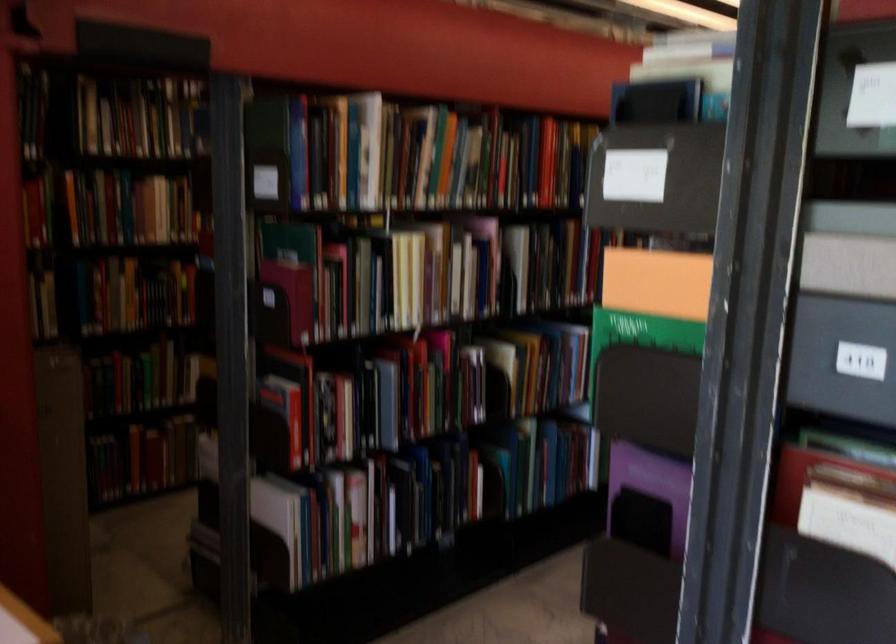
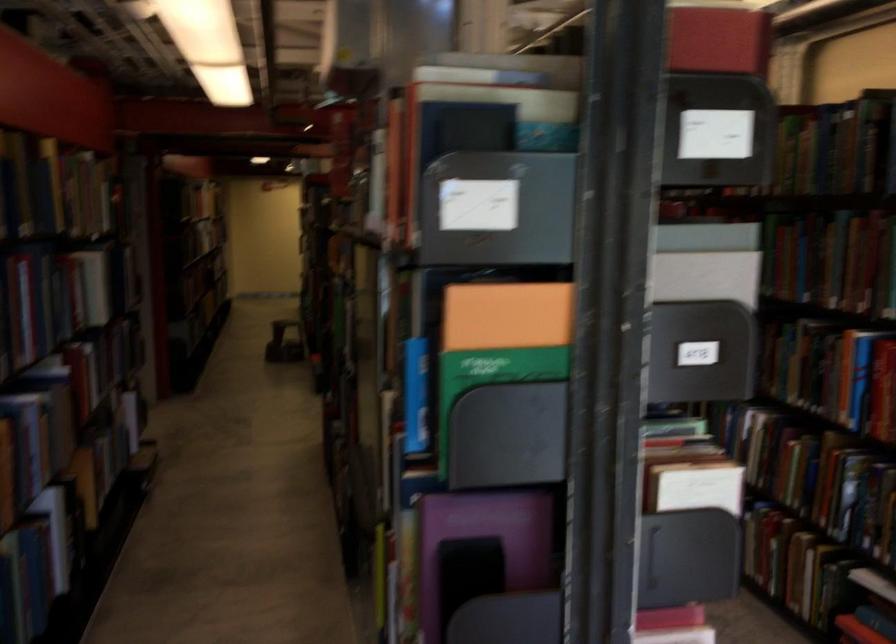
Find the pixel in the second image that matches [662,172] in the first image.

(497, 209)